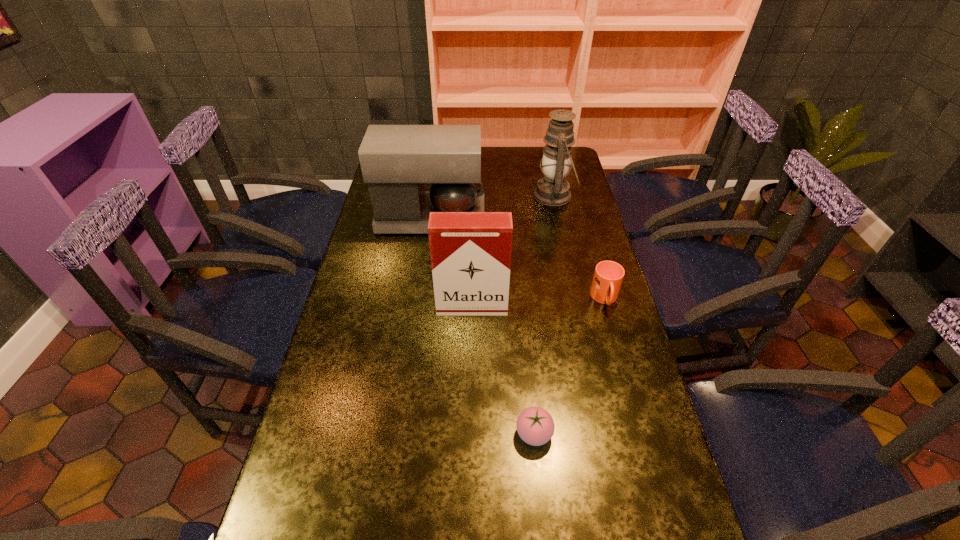
At what (x,y) coordinates should I click in order to perform the action: click on blank region between the coffee maker and the tomato. Please return your answer as a coordinate pair (x, y). The width and height of the screenshot is (960, 540). Looking at the image, I should click on (483, 326).

This screenshot has width=960, height=540. In order to click on vacant area that lies between the coffee maker and the shortest object in this screenshot , I will do `click(483, 326)`.

This screenshot has width=960, height=540. I want to click on empty space that is in between the mug and the cigarette_case, so click(x=539, y=303).

The height and width of the screenshot is (540, 960). Identify the location of free point between the oil lamp and the coffee maker. (492, 207).

I want to click on free point between the oil lamp and the coffee maker, so click(x=492, y=207).

Locate which object is the second closest to the coffee maker. Please provide its 2D coordinates. Your answer should be formatted as a tuple, i.e. [(x, y)], where the tuple contains the x and y coordinates of a point satisfying the conditions above.

[(470, 252)]

At what (x,y) coordinates should I click in order to perform the action: click on object identified as the third closest to the oil lamp. Please return your answer as a coordinate pair (x, y). The width and height of the screenshot is (960, 540). Looking at the image, I should click on point(470,252).

Image resolution: width=960 pixels, height=540 pixels. I want to click on vacant region that satisfies the following two spatial constraints: 1. on the carafe side of the coffee maker; 2. on the left side of the nearest object, so (402, 434).